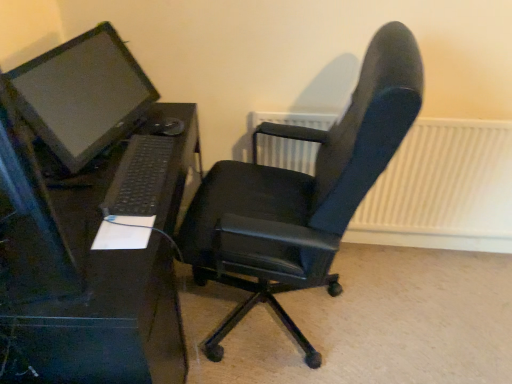
In order to click on free region under black leather office chair at center (from a real-world perspective) in this screenshot , I will do [x=281, y=323].